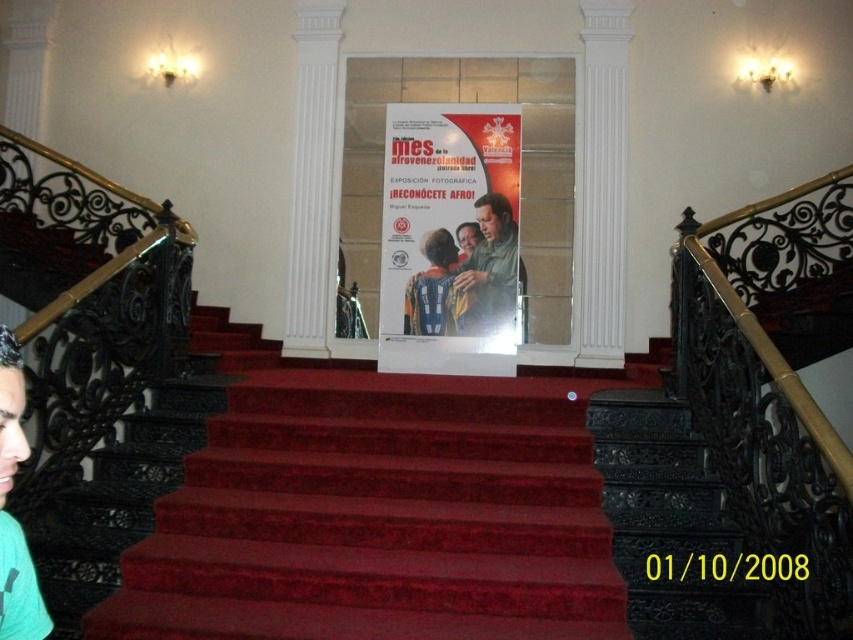
Which of these two, matte paper poster at center or blue fabric shirt at center, stands shorter?

blue fabric shirt at center is shorter.

You are a GUI agent. You are given a task and a screenshot of the screen. Output one action in this format:
    pyautogui.click(x=<x>, y=<y>)
    Task: Click on the matte paper poster at center
    
    Given the screenshot: What is the action you would take?
    pyautogui.click(x=450, y=237)

Can you confirm if matte paper poster at center is positioned to the left of green t-shirt at lower left?

Incorrect, matte paper poster at center is not on the left side of green t-shirt at lower left.

Who is more distant from viewer, (381, 298) or (3, 388)?

The point (381, 298) is more distant.

Which is behind, point (396, 352) or point (6, 365)?

The point (396, 352) is behind.

Find the location of a particular element. matte paper poster at center is located at coordinates (450, 237).

Is point (456, 324) closer to camera compared to point (476, 266)?

Yes, point (456, 324) is closer to viewer.

Between matte paper poster at center and matte green shirt at center, which one has more height?

matte paper poster at center

Describe the element at coordinates (450, 237) in the screenshot. I see `matte paper poster at center` at that location.

I want to click on matte paper poster at center, so click(x=450, y=237).